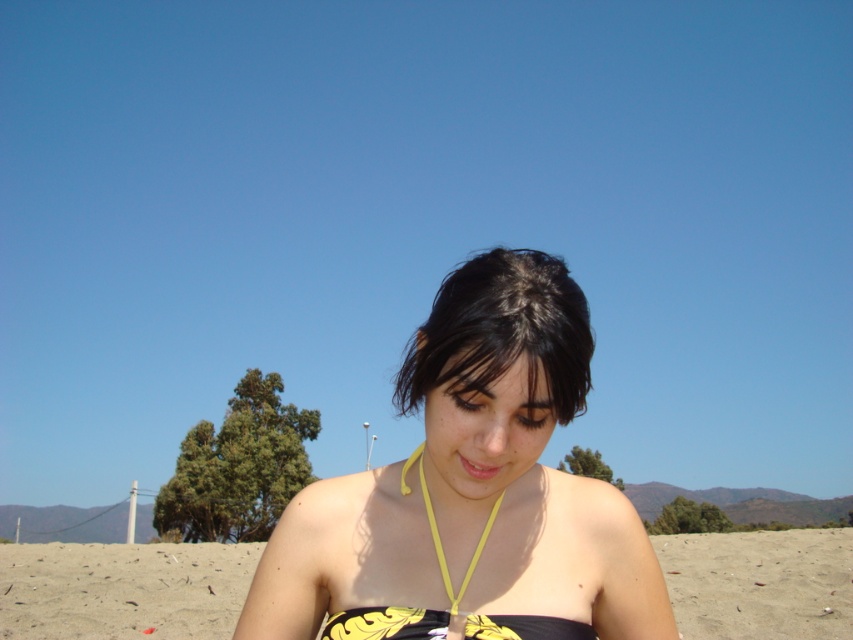
You are a photographer setting up for a beach photoshoot. You have two outfits to choose from for the model. The first is the black matte swimsuit at center, and the second is the yellow printed fabric bikini top at center. The client wants the outfits to be visible clearly in the photos. Based on their positions, which outfit would you recommend and why?

The yellow printed fabric bikini top at center is more visible because it is positioned at the center of the image, making it easier to capture clearly in the photos compared to the black matte swimsuit at center which might blend into the background more easily.

You are a photographer trying to capture the perfect shot of the person in the image. Since you want to highlight the contrast between the two items, you need to know which one is taller. Which one is taller between the black matte swimsuit at center and the yellow printed fabric bikini top at center?

The black matte swimsuit at center is taller than the yellow printed fabric bikini top at center according to the description.

You are a photographer taking a picture of the person in the scene. You want to ensure that both the dark brown hair at center and the yellow printed bikini top at center are clearly visible in the frame. Which object should you adjust your focus on first to ensure proper alignment?

The dark brown hair at center is positioned on the right side of yellow printed bikini top at center. Since the hair is on the right, you should focus on the dark brown hair at center first to ensure proper alignment with the bikini top.